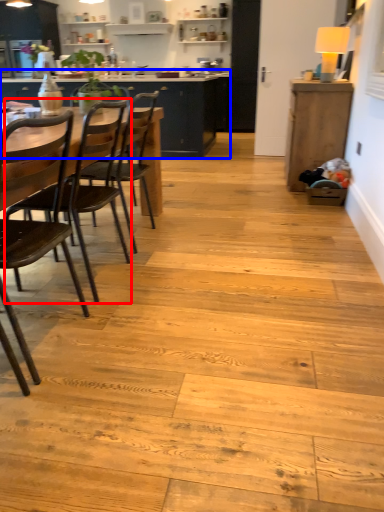
Question: Which object is closer to the camera taking this photo, chair (highlighted by a red box) or cabinetry (highlighted by a blue box)?

Choices:
 (A) chair
 (B) cabinetry

Answer: (A)